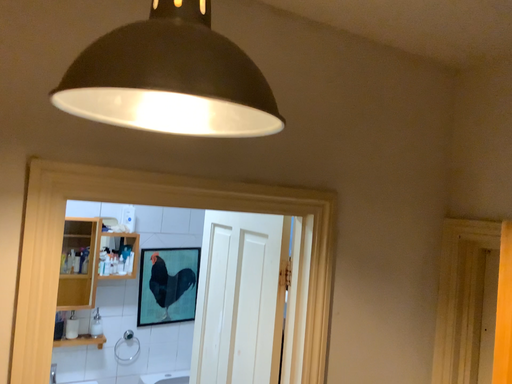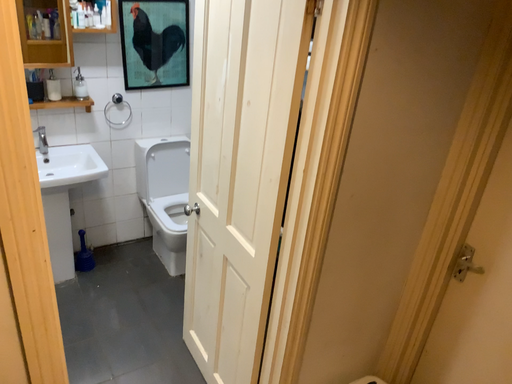
Question: How did the camera likely rotate when shooting the video?

Choices:
 (A) rotated downward
 (B) rotated upward

Answer: (A)